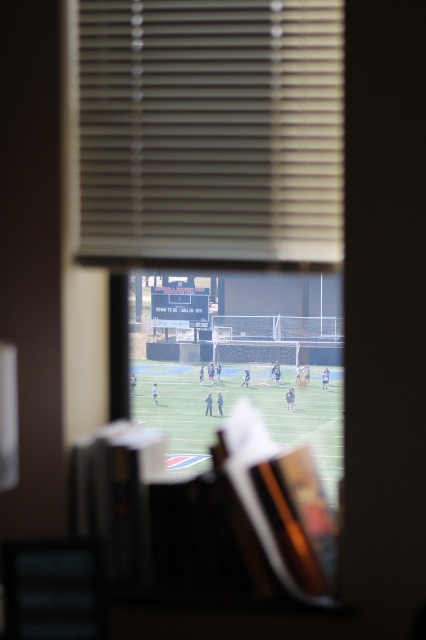
Question: Does matte gray blinds at upper center appear over green grass football field at center?

Choices:
 (A) yes
 (B) no

Answer: (A)

Question: Which point is closer to the camera?

Choices:
 (A) green grass football field at center
 (B) matte gray blinds at upper center

Answer: (B)

Question: Does matte gray blinds at upper center have a lesser width compared to green grass football field at center?

Choices:
 (A) yes
 (B) no

Answer: (A)

Question: Can you confirm if matte gray blinds at upper center is wider than green grass football field at center?

Choices:
 (A) no
 (B) yes

Answer: (A)

Question: Which point appears closest to the camera in this image?

Choices:
 (A) (169, 376)
 (B) (213, 44)

Answer: (B)